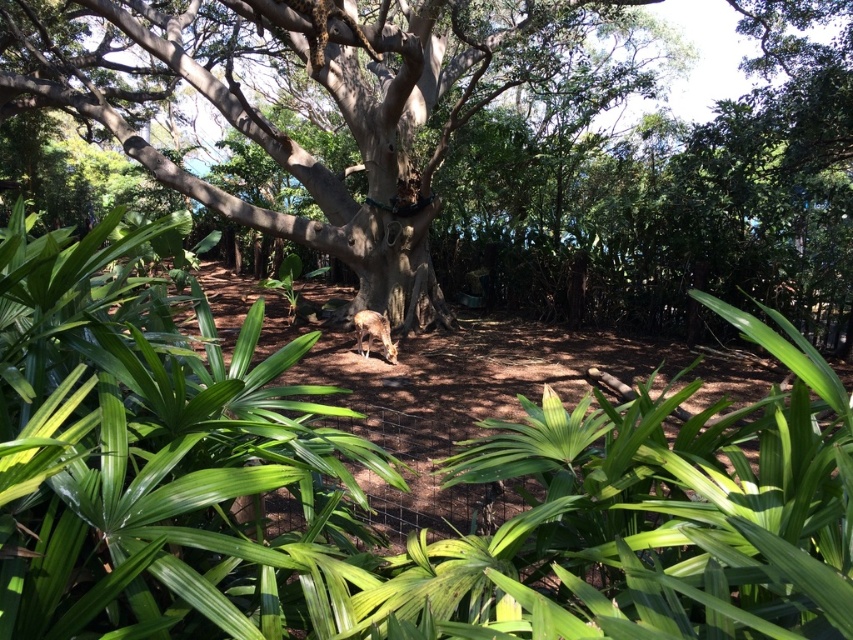
Who is more distant from viewer, (798, 86) or (357, 342)?

The point (357, 342) is more distant.

Is smooth bark tree at center above fur-like brown animal at center?

Yes.

Image resolution: width=853 pixels, height=640 pixels. Identify the location of smooth bark tree at center. (485, 145).

Identify the location of smooth bark tree at center. (485, 145).

Is green leafy plant at center thinner than fur-like brown animal at center?

In fact, green leafy plant at center might be wider than fur-like brown animal at center.

Between point (57, 291) and point (383, 340), which one is positioned behind?

The point (383, 340) is more distant.

Where is `green leafy plant at center`? The image size is (853, 640). green leafy plant at center is located at coordinates (396, 486).

The image size is (853, 640). I want to click on green leafy plant at center, so [x=396, y=486].

Can you confirm if green leafy plant at center is bigger than smooth bark tree at center?

Actually, green leafy plant at center might be smaller than smooth bark tree at center.

Is green leafy plant at center closer to the viewer compared to smooth bark tree at center?

That is True.

Image resolution: width=853 pixels, height=640 pixels. What are the coordinates of `green leafy plant at center` in the screenshot? It's located at click(396, 486).